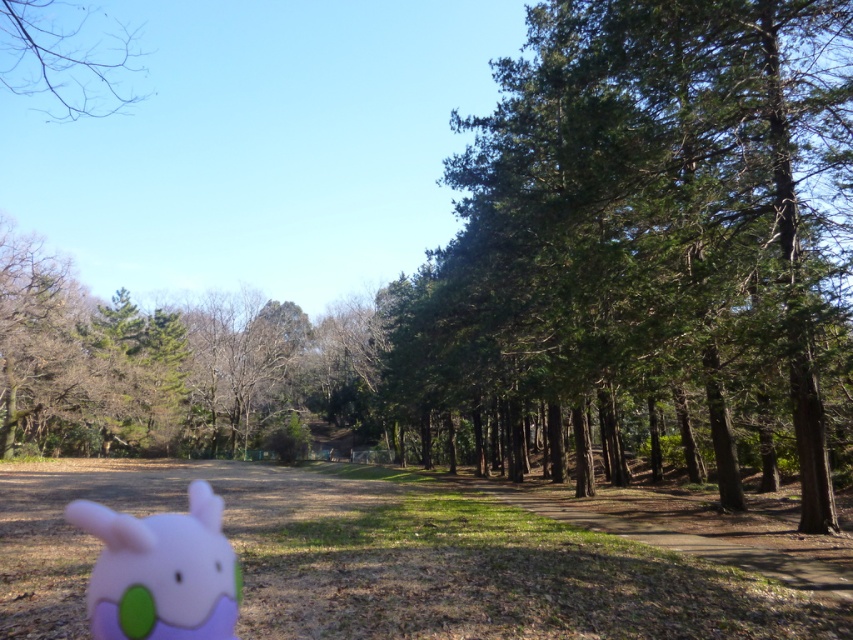
Question: Does plush pink toy at lower left lie behind bare branches at upper left?

Choices:
 (A) yes
 (B) no

Answer: (B)

Question: Does green textured tree at center lie in front of bare branches at upper left?

Choices:
 (A) yes
 (B) no

Answer: (A)

Question: Which object appears closest to the camera in this image?

Choices:
 (A) bare branches at upper left
 (B) plush pink toy at lower left

Answer: (B)

Question: Considering the relative positions of green textured tree at center and plush pink toy at lower left in the image provided, where is green textured tree at center located with respect to plush pink toy at lower left?

Choices:
 (A) above
 (B) below

Answer: (A)

Question: Which of the following is the closest to the observer?

Choices:
 (A) (131, 566)
 (B) (567, 301)
 (C) (57, 109)

Answer: (A)

Question: Among these objects, which one is farthest from the camera?

Choices:
 (A) bare branches at upper left
 (B) green textured tree at center
 (C) plush pink toy at lower left

Answer: (A)